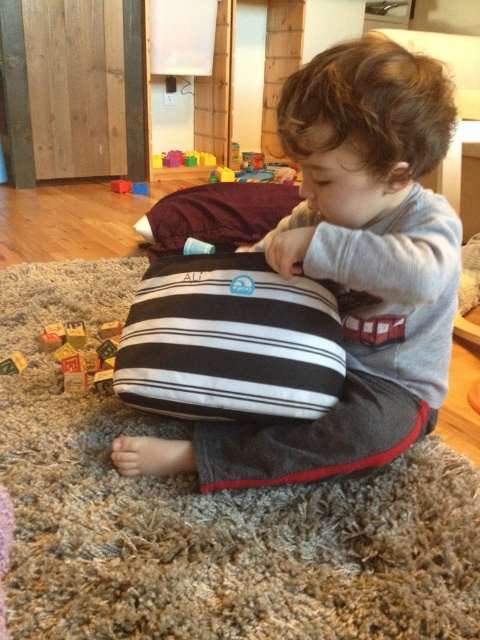
You are a parent trying to choose between the black striped cushion at center and the black striped pillow at center for your child to play with. Which item is smaller in width?

The black striped cushion at center is smaller in width than the black striped pillow at center.